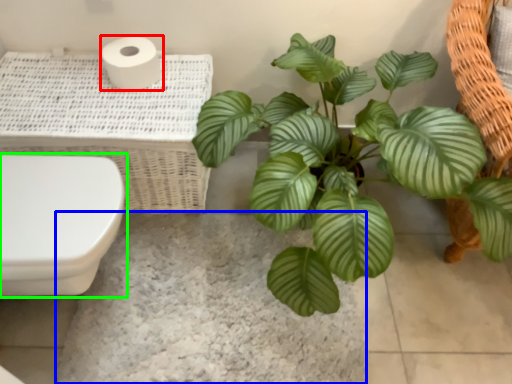
Question: Considering the real-world distances, which object is farthest from toilet paper (highlighted by a red box)? concrete (highlighted by a blue box) or toilet (highlighted by a green box)?

Choices:
 (A) concrete
 (B) toilet

Answer: (A)